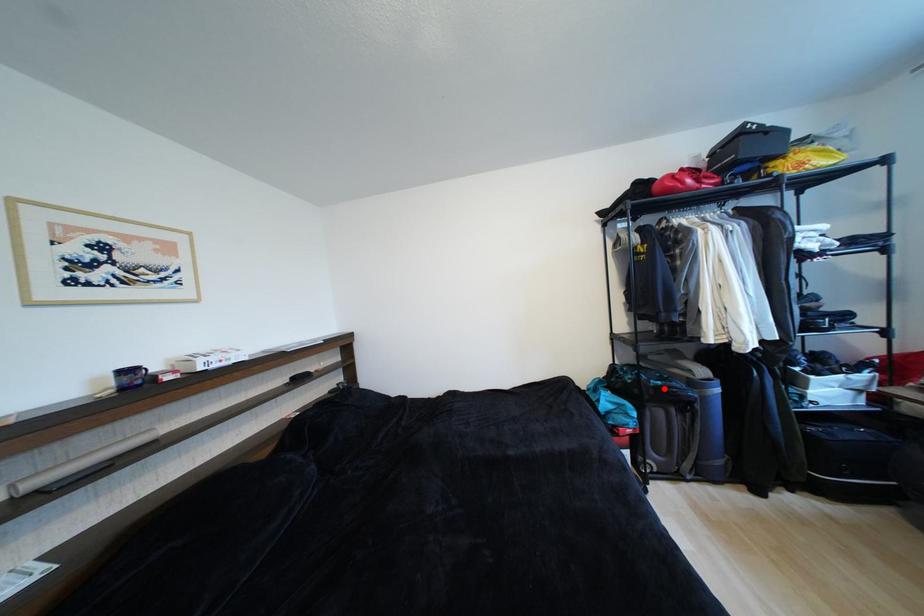
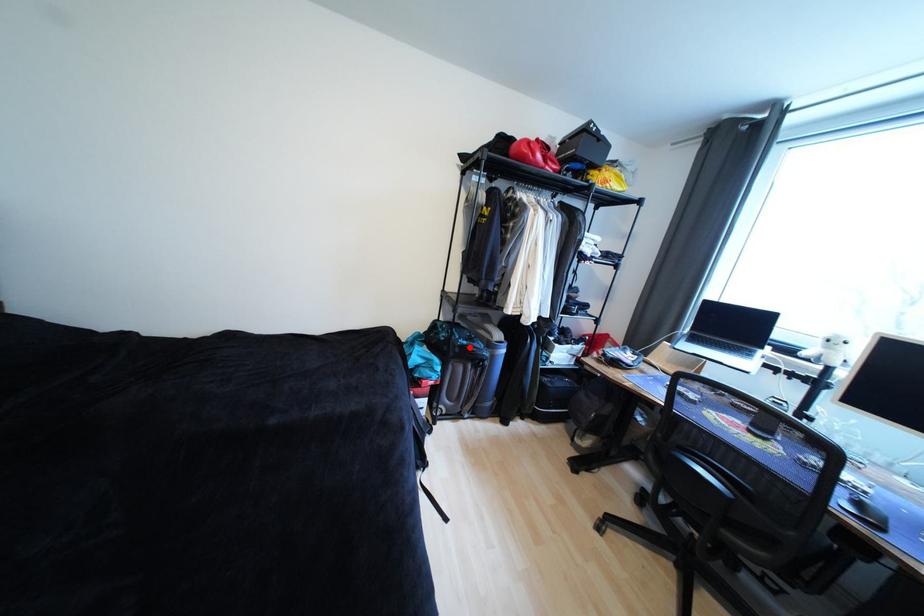
I am providing you with two images of the same scene from different viewpoints. A red point is marked on the first image and another point is marked on the second image. Do the highlighted points in image1 and image2 indicate the same real-world spot?

Yes